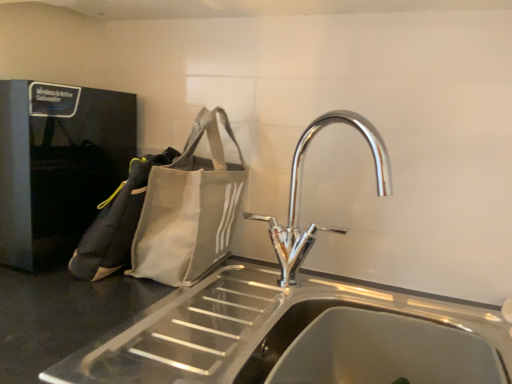
Question: Is the position of stainless steel sink at center less distant than that of chrome metallic tap at center?

Choices:
 (A) yes
 (B) no

Answer: (A)

Question: Is stainless steel sink at center smaller than chrome metallic tap at center?

Choices:
 (A) no
 (B) yes

Answer: (A)

Question: Is stainless steel sink at center bigger than chrome metallic tap at center?

Choices:
 (A) no
 (B) yes

Answer: (B)

Question: Is stainless steel sink at center shorter than chrome metallic tap at center?

Choices:
 (A) yes
 (B) no

Answer: (A)

Question: From the image's perspective, does stainless steel sink at center appear lower than chrome metallic tap at center?

Choices:
 (A) yes
 (B) no

Answer: (A)

Question: Considering their positions, is white canvas tote bag at left, the second pouch positioned from the right, located in front of or behind gray fabric tote bag at left, which is the first pouch from right to left?

Choices:
 (A) front
 (B) behind

Answer: (B)

Question: In terms of height, does white canvas tote bag at left, which is the 1th pouch in left-to-right order, look taller or shorter compared to gray fabric tote bag at left, which is the first pouch from right to left?

Choices:
 (A) short
 (B) tall

Answer: (A)

Question: Is point (138, 170) positioned closer to the camera than point (174, 241)?

Choices:
 (A) closer
 (B) farther

Answer: (A)

Question: Is white canvas tote bag at left, which is the 1th pouch in left-to-right order, to the left or to the right of gray fabric tote bag at left, which is the first pouch from right to left, in the image?

Choices:
 (A) left
 (B) right

Answer: (A)

Question: From the image's perspective, is stainless steel sink at center located above or below chrome metallic tap at center?

Choices:
 (A) above
 (B) below

Answer: (B)

Question: In the image, is stainless steel sink at center on the left side or the right side of chrome metallic tap at center?

Choices:
 (A) left
 (B) right

Answer: (B)

Question: From a real-world perspective, relative to chrome metallic tap at center, is stainless steel sink at center vertically above or below?

Choices:
 (A) below
 (B) above

Answer: (A)

Question: Is stainless steel sink at center wider or thinner than chrome metallic tap at center?

Choices:
 (A) thin
 (B) wide

Answer: (B)

Question: From the image's perspective, is stainless steel sink at center above or below gray fabric tote bag at left, which is the first pouch from right to left?

Choices:
 (A) above
 (B) below

Answer: (B)

Question: Considering the positions of point (287, 372) and point (209, 248), is point (287, 372) closer or farther from the camera than point (209, 248)?

Choices:
 (A) closer
 (B) farther

Answer: (A)